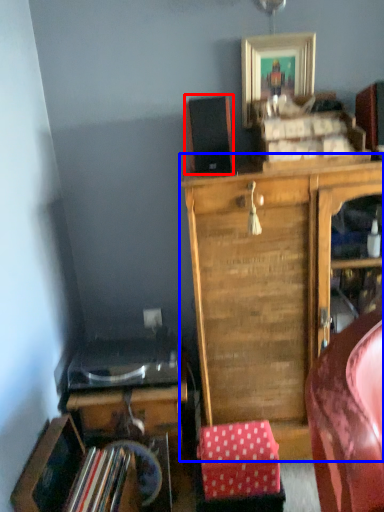
Question: Which point is closer to the camera, speaker (highlighted by a red box) or cabinetry (highlighted by a blue box)?

Choices:
 (A) speaker
 (B) cabinetry

Answer: (B)